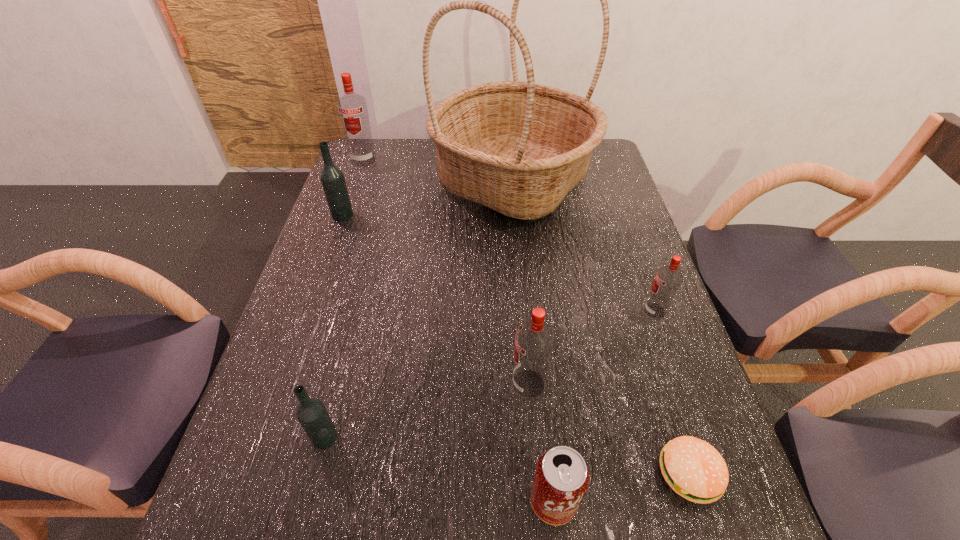
This screenshot has height=540, width=960. I want to click on the third vodka from left to right, so click(311, 413).

Where is `the second shortest object`? The image size is (960, 540). the second shortest object is located at coordinates click(x=561, y=479).

Where is `red soda can`? red soda can is located at coordinates (561, 479).

You are a GUI agent. You are given a task and a screenshot of the screen. Output one action in this format:
    pyautogui.click(x=<x>, y=<y>)
    Task: Click on the shortest object
    The image size is (960, 540).
    Given the screenshot: What is the action you would take?
    pyautogui.click(x=693, y=468)

Locate an element on the screen. The width and height of the screenshot is (960, 540). brown patty is located at coordinates (693, 468).

Where is `vacant space located on the front of the basket`? The width and height of the screenshot is (960, 540). vacant space located on the front of the basket is located at coordinates pos(524,300).

In order to click on vacant space situated 0.120m on the front label of the leftmost red vodka in this screenshot , I will do `click(354, 187)`.

The height and width of the screenshot is (540, 960). In order to click on free space located 0.300m on the front of the fourth nearest vodka in this screenshot , I will do `click(314, 296)`.

Where is `vacant position located 0.230m on the front label of the second vodka from right to left`? The height and width of the screenshot is (540, 960). vacant position located 0.230m on the front label of the second vodka from right to left is located at coordinates point(403,384).

At what (x,y) coordinates should I click in order to perform the action: click on vacant space located 0.220m on the front label of the second vodka from right to left. Please return your answer as a coordinate pair (x, y). The image size is (960, 540). Looking at the image, I should click on (408, 384).